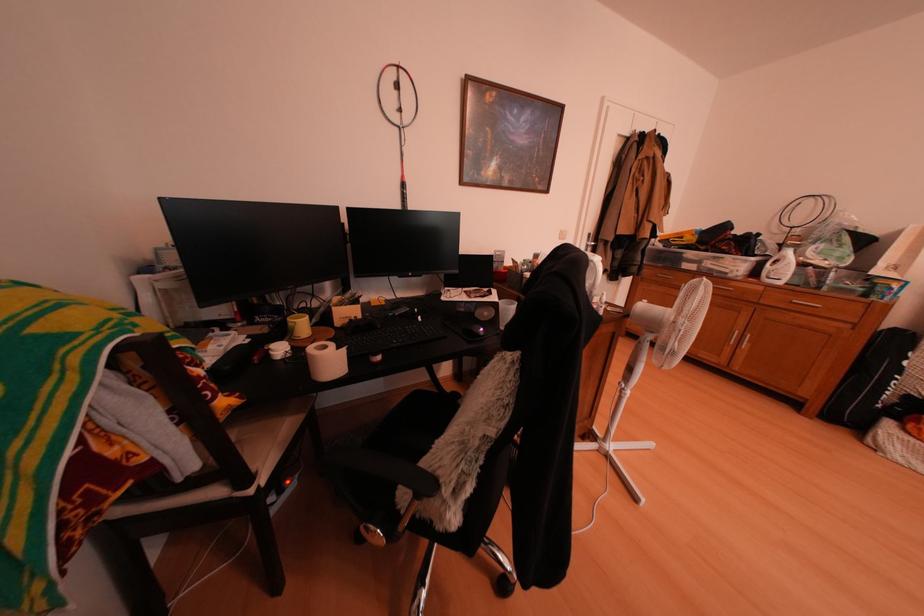
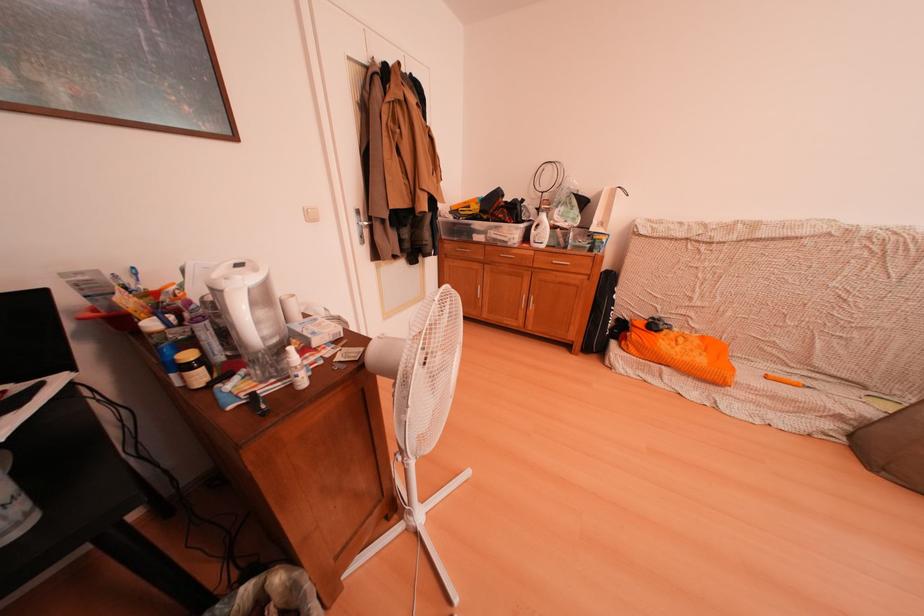
Question: The camera is either moving clockwise (left) or counter-clockwise (right) around the object. The first image is from the beginning of the video and the second image is from the end. Is the camera moving left or right when shooting the video?

Choices:
 (A) Left
 (B) Right

Answer: (A)